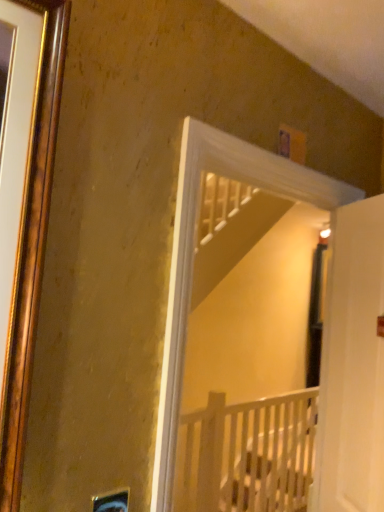
Question: Is white matte door at right closer to camera compared to white wooden crib at center?

Choices:
 (A) no
 (B) yes

Answer: (B)

Question: Does white matte door at right come behind white wooden crib at center?

Choices:
 (A) no
 (B) yes

Answer: (A)

Question: Does white matte door at right have a lesser width compared to white wooden crib at center?

Choices:
 (A) yes
 (B) no

Answer: (A)

Question: From the image's perspective, does white matte door at right appear higher than white wooden crib at center?

Choices:
 (A) no
 (B) yes

Answer: (B)

Question: Is white matte door at right in contact with white wooden crib at center?

Choices:
 (A) no
 (B) yes

Answer: (A)

Question: Can you confirm if white matte door at right is bigger than white wooden crib at center?

Choices:
 (A) yes
 (B) no

Answer: (B)

Question: From a real-world perspective, is white wooden crib at center positioned under white matte door at right based on gravity?

Choices:
 (A) yes
 (B) no

Answer: (A)

Question: Can you confirm if white wooden crib at center is taller than white matte door at right?

Choices:
 (A) no
 (B) yes

Answer: (A)

Question: From a real-world perspective, is white wooden crib at center on top of white matte door at right?

Choices:
 (A) yes
 (B) no

Answer: (B)

Question: Is white wooden crib at center touching white matte door at right?

Choices:
 (A) no
 (B) yes

Answer: (A)

Question: Can you confirm if white wooden crib at center is bigger than white matte door at right?

Choices:
 (A) no
 (B) yes

Answer: (B)

Question: From the image's perspective, would you say white wooden crib at center is shown under white matte door at right?

Choices:
 (A) no
 (B) yes

Answer: (B)

Question: In terms of width, does white matte door at right look wider or thinner when compared to white wooden crib at center?

Choices:
 (A) wide
 (B) thin

Answer: (B)